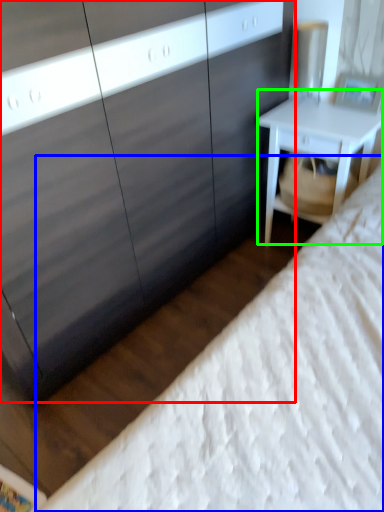
Question: Considering the real-world distances, which object is closest to dresser (highlighted by a red box)? bed (highlighted by a blue box) or nightstand (highlighted by a green box).

Choices:
 (A) bed
 (B) nightstand

Answer: (B)